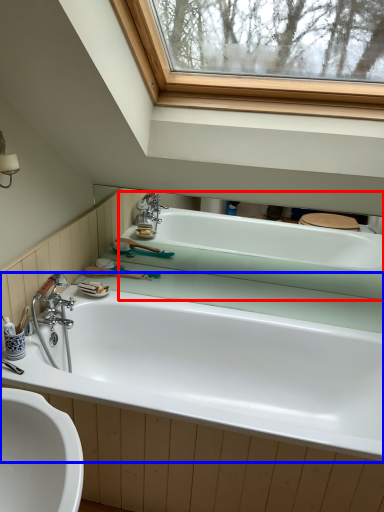
Question: Among these objects, which one is nearest to the camera, bathtub (highlighted by a red box) or bathtub (highlighted by a blue box)?

Choices:
 (A) bathtub
 (B) bathtub

Answer: (B)